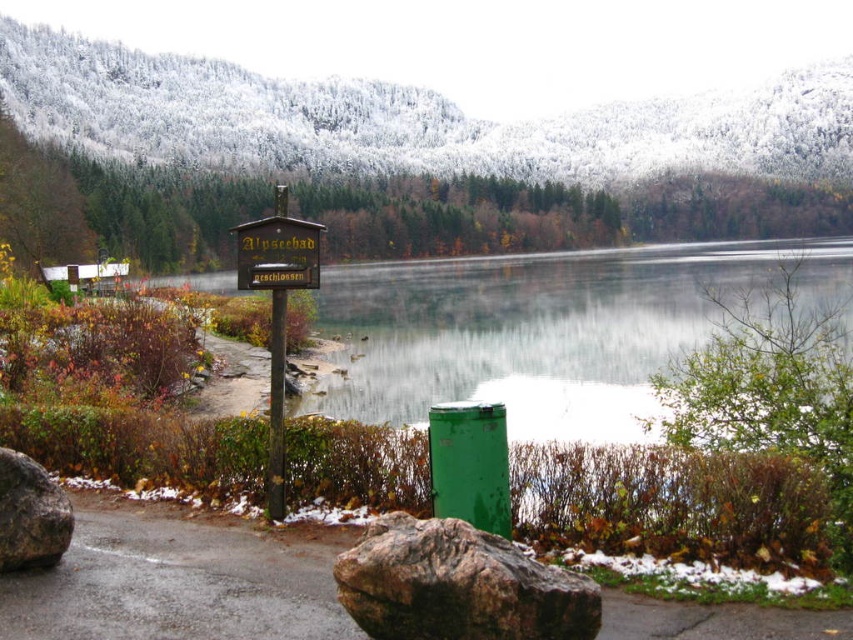
Question: Can you confirm if rough gray rock at lower left is positioned to the right of wooden sign at center?

Choices:
 (A) no
 (B) yes

Answer: (A)

Question: Is wooden sign at left above wooden sign at center?

Choices:
 (A) yes
 (B) no

Answer: (A)

Question: Which of the following is the closest to the observer?

Choices:
 (A) (345, 131)
 (B) (262, 241)

Answer: (B)

Question: Among these objects, which one is farthest from the camera?

Choices:
 (A) green metallic water at center
 (B) rough gray rock at lower left
 (C) wooden sign at center
 (D) wooden sign at left

Answer: (A)

Question: Which of the following is the closest to the observer?

Choices:
 (A) (526, 177)
 (B) (465, 259)
 (C) (257, 237)
 (D) (384, 545)

Answer: (D)

Question: Can you confirm if brown rough rock at lower center is positioned above wooden sign at left?

Choices:
 (A) yes
 (B) no

Answer: (B)